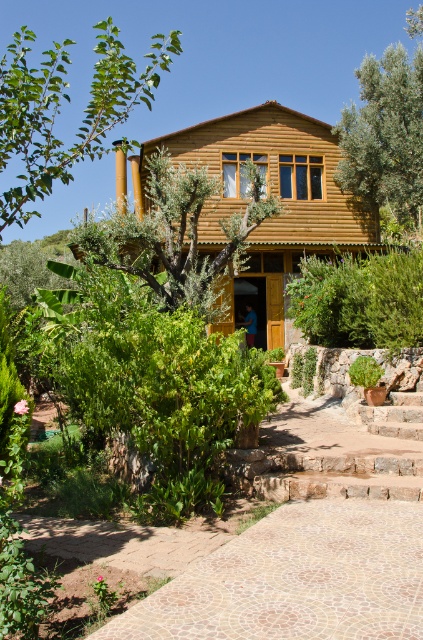
Question: Observing the image, what is the correct spatial positioning of mosaic stone path at lower center in reference to green leafy tree at upper right?

Choices:
 (A) left
 (B) right

Answer: (A)

Question: Is mosaic stone path at lower center to the left of green leafy tree at upper right from the viewer's perspective?

Choices:
 (A) no
 (B) yes

Answer: (B)

Question: Estimate the real-world distances between objects in this image. Which object is closer to the green leafy tree at upper left?

Choices:
 (A) green leafy tree at upper right
 (B) mosaic stone path at lower center
 (C) green leafy tree at center

Answer: (A)

Question: Can you confirm if mosaic stone path at lower center is bigger than green leafy tree at upper left?

Choices:
 (A) no
 (B) yes

Answer: (A)

Question: Which object is the closest to the green leafy tree at upper right?

Choices:
 (A) mosaic stone path at lower center
 (B) green leafy tree at upper left

Answer: (B)

Question: Which point appears closest to the camera in this image?

Choices:
 (A) (351, 179)
 (B) (351, 518)
 (C) (164, 54)

Answer: (B)